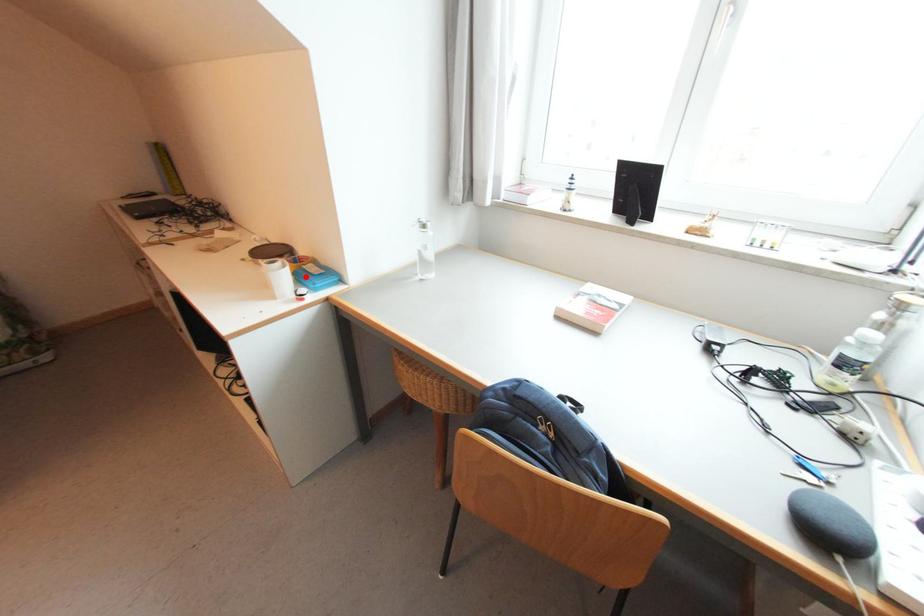
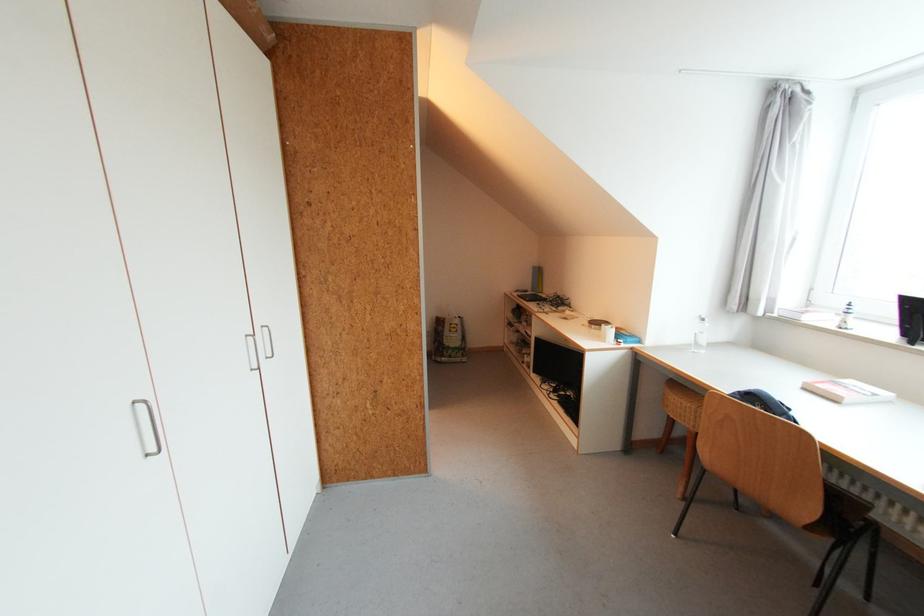
Where in the second image is the point corresponding to the highlighted location from the first image?

(625, 334)